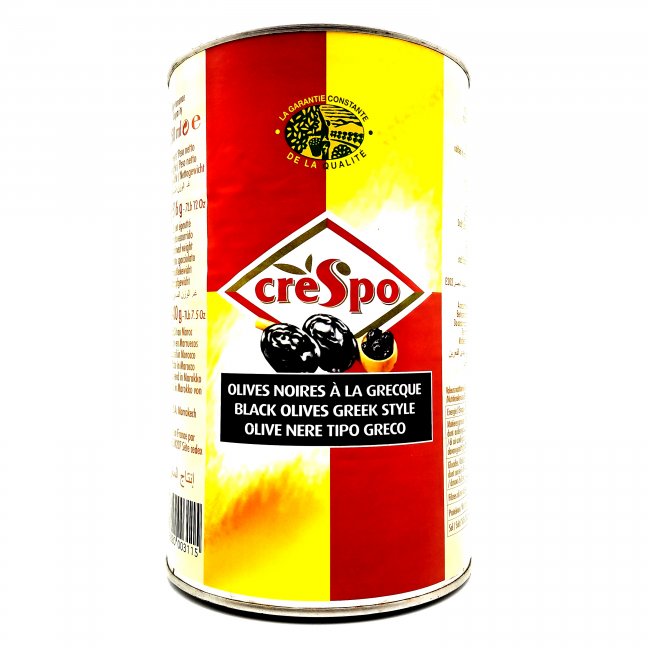
Where is `bowl`? This screenshot has width=648, height=648. bowl is located at coordinates (378, 364).